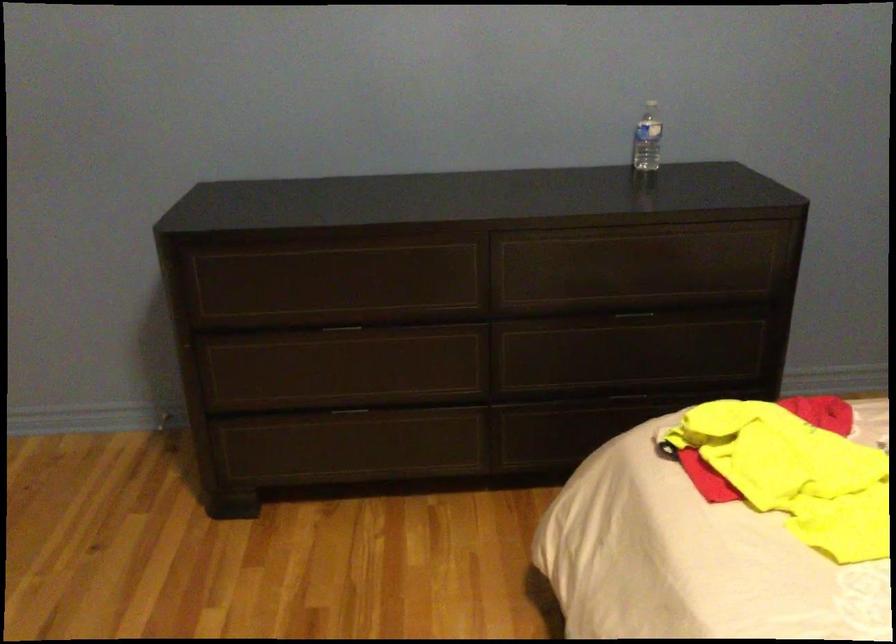
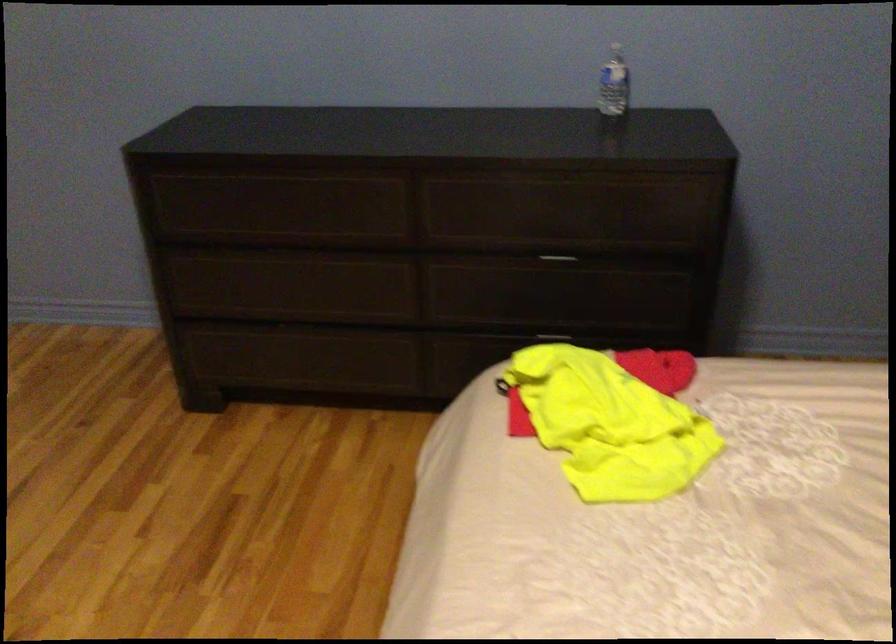
In the second image, find the point that corresponds to (638,315) in the first image.

(557, 260)